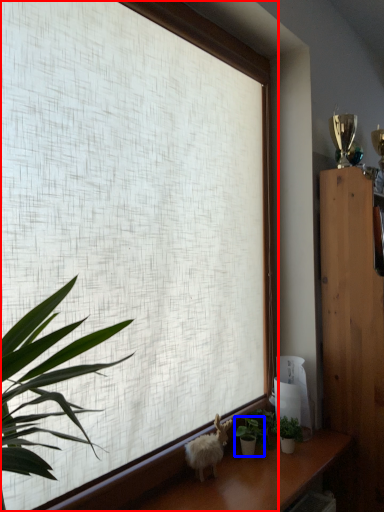
Question: Which of the following is the closest to the observer, window (highlighted by a red box) or houseplant (highlighted by a blue box)?

Choices:
 (A) window
 (B) houseplant

Answer: (A)